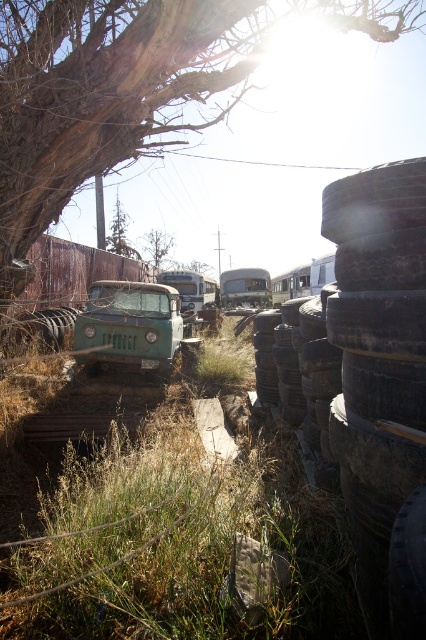
You are standing in the junkyard and want to walk from the green grass at center to the vintage green Jeep parked in the midground. Which direction should you walk to avoid the brown rough tree at upper center?

The green grass at center is positioned under the brown rough tree at upper center, so to avoid the tree, you should walk away from the brown rough tree at upper center towards the vintage green Jeep in the midground.

You are standing at the point marked by the coordinate point (178, 541) in the image. What is directly under your feet?

The point (178, 541) is labeled as green grass at center, so you are standing on green grass at center.

You are a mechanic trying to access the green matte school bus at center to perform maintenance. However, there are charcoal rubber tires at right blocking your path. Based on their heights, can you walk around them without climbing over?

The charcoal rubber tires at right are not as tall as the green matte school bus at center, so you can walk around them without needing to climb over.